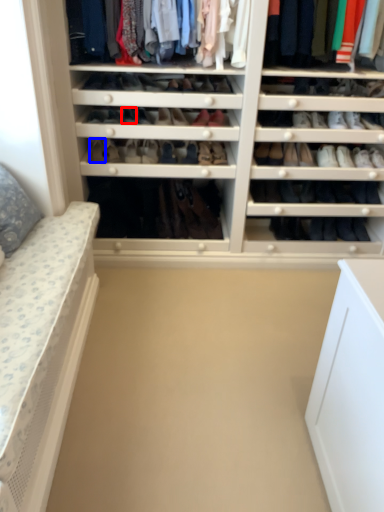
Question: Which of the following is the farthest to the observer, shoe (highlighted by a red box) or shoe (highlighted by a blue box)?

Choices:
 (A) shoe
 (B) shoe

Answer: (B)